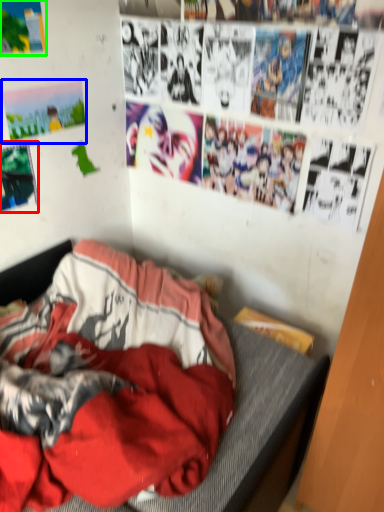
Question: Based on their relative distances, which object is nearer to poster page (highlighted by a red box)? Choose from poster page (highlighted by a blue box) and poster page (highlighted by a green box).

Choices:
 (A) poster page
 (B) poster page

Answer: (A)